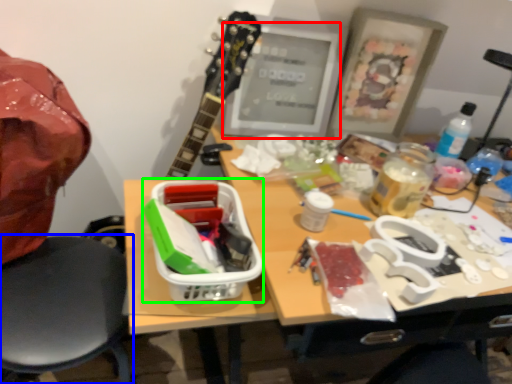
Question: Considering the real-world distances, which object is farthest from computer monitor (highlighted by a red box)? chair (highlighted by a blue box) or lunch box (highlighted by a green box)?

Choices:
 (A) chair
 (B) lunch box

Answer: (A)